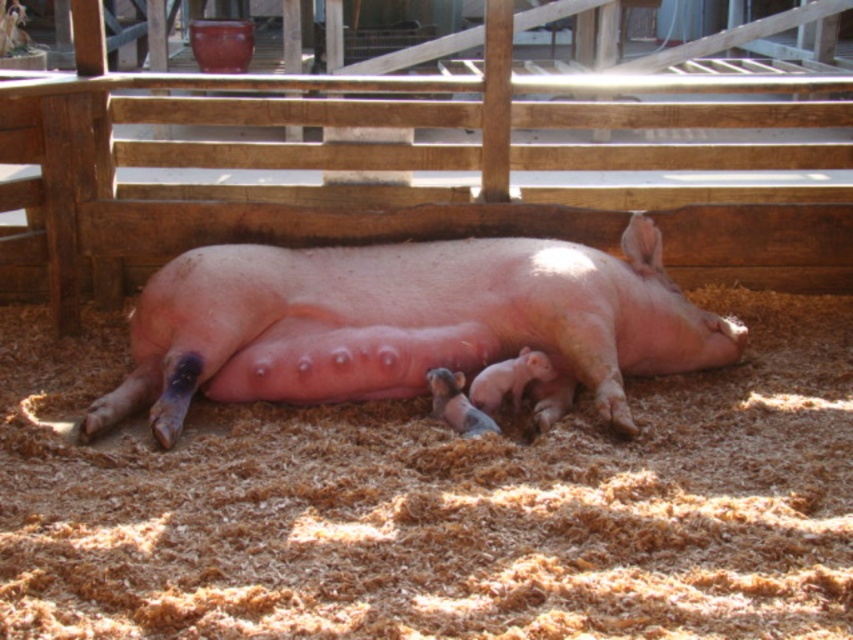
Measure the distance between brown sawdust at center and camera.

A distance of 2.55 meters exists between brown sawdust at center and camera.

Does brown sawdust at center appear under pink smooth pig at center?

Indeed, brown sawdust at center is positioned under pink smooth pig at center.

Locate an element on the screen. brown sawdust at center is located at coordinates (436, 504).